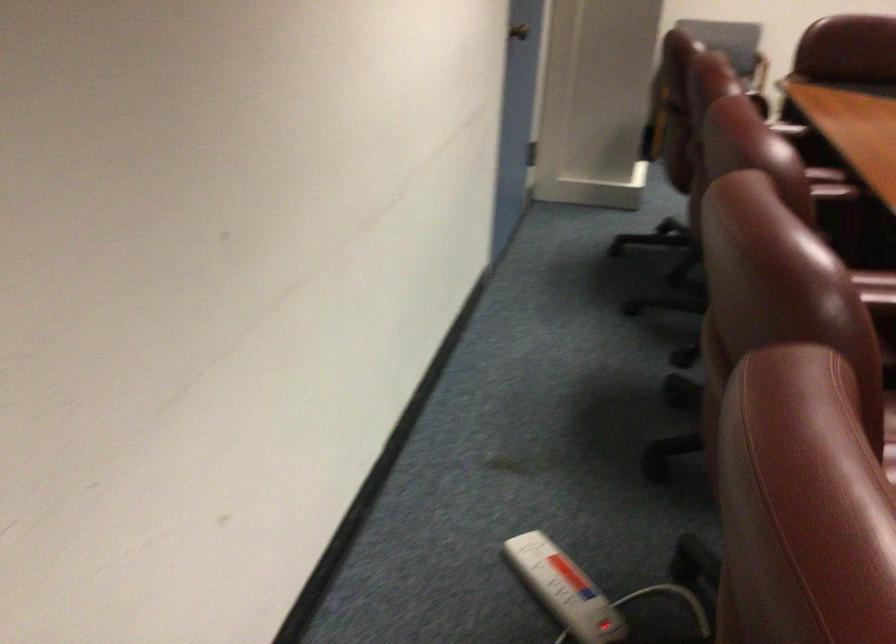
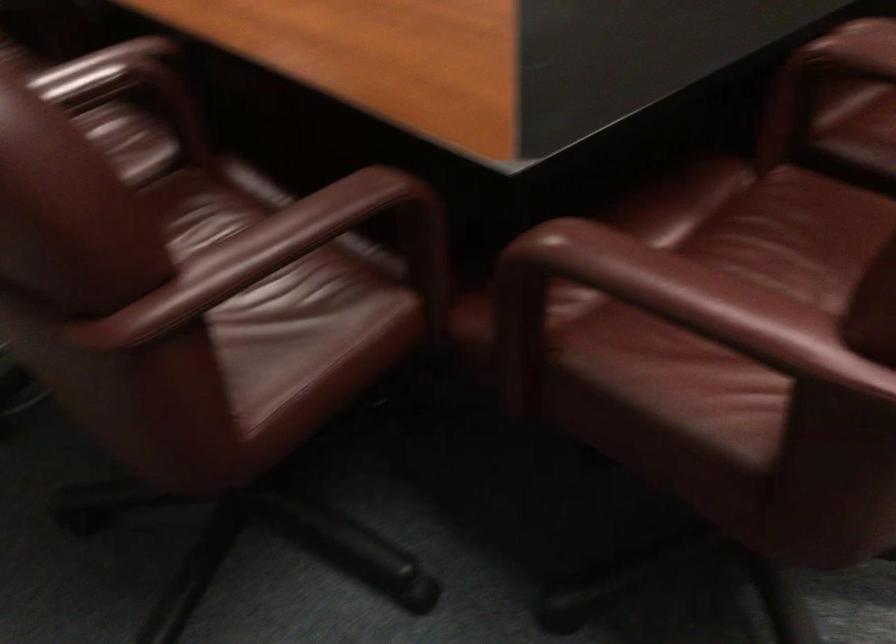
The first image is from the beginning of the video and the second image is from the end. How did the camera likely rotate when shooting the video?

The camera's rotation is toward right-down.